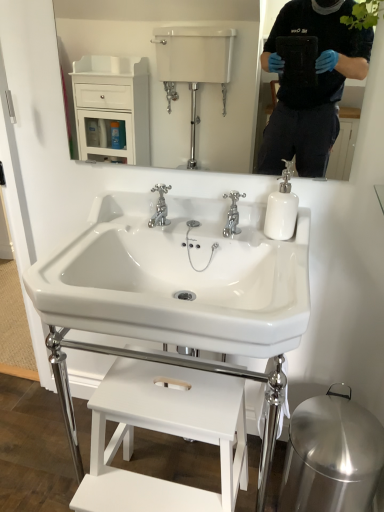
Question: From a real-world perspective, is white glossy soap dispenser at upper right positioned above or below white matte stool at lower center?

Choices:
 (A) above
 (B) below

Answer: (A)

Question: Would you say white glossy soap dispenser at upper right is inside or outside white matte stool at lower center?

Choices:
 (A) outside
 (B) inside

Answer: (A)

Question: Estimate the real-world distances between objects in this image. Which object is closer to the white glossy sink at center?

Choices:
 (A) white matte stool at lower center
 (B) white glossy mirror at upper center
 (C) white glossy soap dispenser at upper right
 (D) chrome metallic faucet at center

Answer: (C)

Question: Which is nearer to the white glossy soap dispenser at upper right?

Choices:
 (A) white glossy sink at center
 (B) white glossy mirror at upper center
 (C) white matte stool at lower center
 (D) chrome metallic faucet at center

Answer: (D)